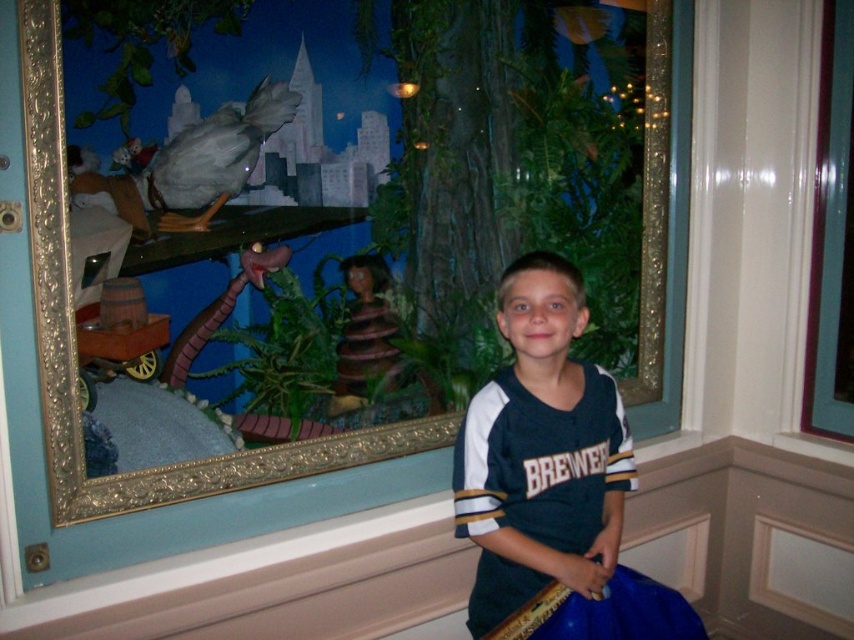
Question: Is dark blue jersey at center to the right of transparent glass window at upper right from the viewer's perspective?

Choices:
 (A) no
 (B) yes

Answer: (A)

Question: In this image, where is dark blue jersey at center located relative to transparent glass window at upper right?

Choices:
 (A) right
 (B) left

Answer: (B)

Question: Which object appears farthest from the camera in this image?

Choices:
 (A) dark blue jersey at center
 (B) transparent glass window at upper right

Answer: (B)

Question: Does dark blue jersey at center have a lesser width compared to transparent glass window at upper right?

Choices:
 (A) no
 (B) yes

Answer: (A)

Question: Which point appears farthest from the camera in this image?

Choices:
 (A) 577,481
 (B) 829,80

Answer: (B)